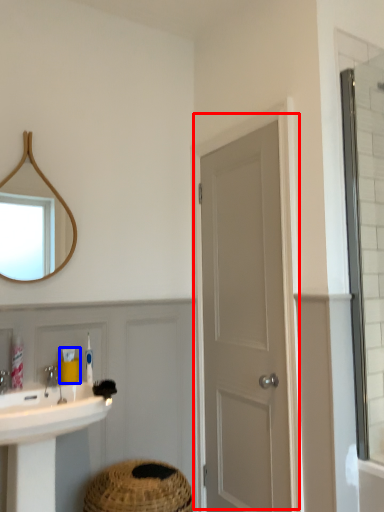
Question: Which point is closer to the camera, door (highlighted by a red box) or toiletry (highlighted by a blue box)?

Choices:
 (A) door
 (B) toiletry

Answer: (A)